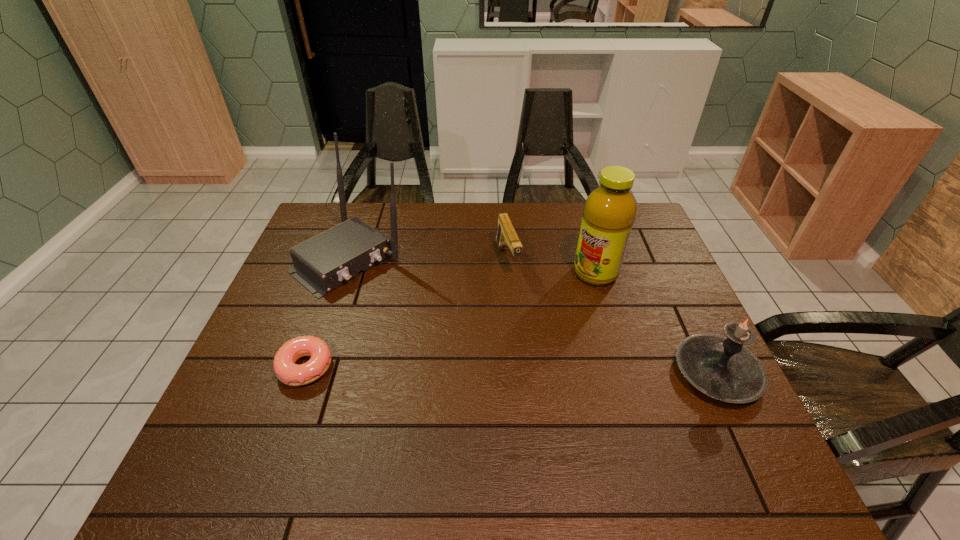
Image resolution: width=960 pixels, height=540 pixels. What are the coordinates of `object positioned at the near edge` in the screenshot? It's located at (722, 368).

The height and width of the screenshot is (540, 960). Identify the location of doughnut that is at the left edge. (289, 373).

This screenshot has height=540, width=960. I want to click on router at the left edge, so click(x=322, y=263).

Where is `candle situated at the right edge`? Image resolution: width=960 pixels, height=540 pixels. candle situated at the right edge is located at coordinates (722, 368).

This screenshot has width=960, height=540. In order to click on fruit juice that is at the right edge in this screenshot , I will do `click(609, 212)`.

The height and width of the screenshot is (540, 960). Find the location of `object present at the far left corner`. object present at the far left corner is located at coordinates (322, 263).

Identify the location of object that is positioned at the near right corner. The height and width of the screenshot is (540, 960). (722, 368).

Where is `vacant space at the far edge of the desktop`? The height and width of the screenshot is (540, 960). vacant space at the far edge of the desktop is located at coordinates (529, 220).

In order to click on blank space at the near edge of the desktop in this screenshot , I will do `click(619, 431)`.

You are a GUI agent. You are given a task and a screenshot of the screen. Output one action in this format:
    pyautogui.click(x=<x>, y=<y>)
    Task: Click on the free space at the right edge of the desktop
    
    Given the screenshot: What is the action you would take?
    pyautogui.click(x=659, y=271)